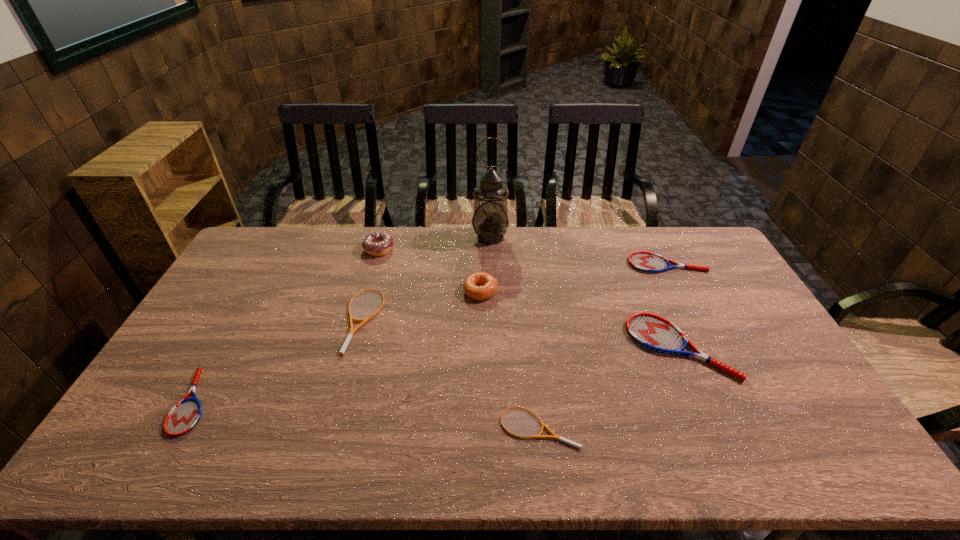
Locate an element on the screen. empty location between the leftmost tennis racket and the farthest tennis racket is located at coordinates (430, 333).

Image resolution: width=960 pixels, height=540 pixels. What are the coordinates of `free space between the farthest tennis racket and the fourth tennis racket from right to left` in the screenshot? It's located at (515, 293).

Identify the location of free space between the smallest blue tennis racket and the right doughnut. The height and width of the screenshot is (540, 960). (337, 346).

Where is `object identified as the sixth closest to the third tennis racket from left to right`? The width and height of the screenshot is (960, 540). object identified as the sixth closest to the third tennis racket from left to right is located at coordinates (377, 243).

Image resolution: width=960 pixels, height=540 pixels. Identify the location of object identified as the second closest to the bigger beige tennis racket. (471, 286).

You are a GUI agent. You are given a task and a screenshot of the screen. Output one action in this format:
    pyautogui.click(x=<x>, y=<y>)
    Task: Click on the tennis racket identified as the closest to the left beige tennis racket
    This screenshot has width=960, height=540.
    Given the screenshot: What is the action you would take?
    pyautogui.click(x=184, y=416)

Find the location of `tennis racket that is the fifth closest one to the tan doughnut`. tennis racket that is the fifth closest one to the tan doughnut is located at coordinates (184, 416).

Select which blue tennis racket appears as the third closest to the bigger beige tennis racket. Please provide its 2D coordinates. Your answer should be formatted as a tuple, i.e. [(x, y)], where the tuple contains the x and y coordinates of a point satisfying the conditions above.

[(648, 262)]

Find the location of a particular element. Image resolution: width=960 pixels, height=540 pixels. the closest blue tennis racket to the second smallest blue tennis racket is located at coordinates pyautogui.click(x=651, y=331).

Locate an element on the screen. vacant space that satisfies the following two spatial constraints: 1. on the back side of the oil lamp; 2. on the right side of the left doughnut is located at coordinates click(382, 237).